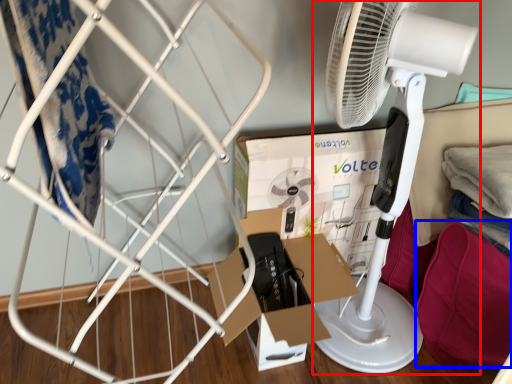
Question: Among these objects, which one is farthest to the camera, mechanical fan (highlighted by a red box) or clothing (highlighted by a blue box)?

Choices:
 (A) mechanical fan
 (B) clothing

Answer: (B)